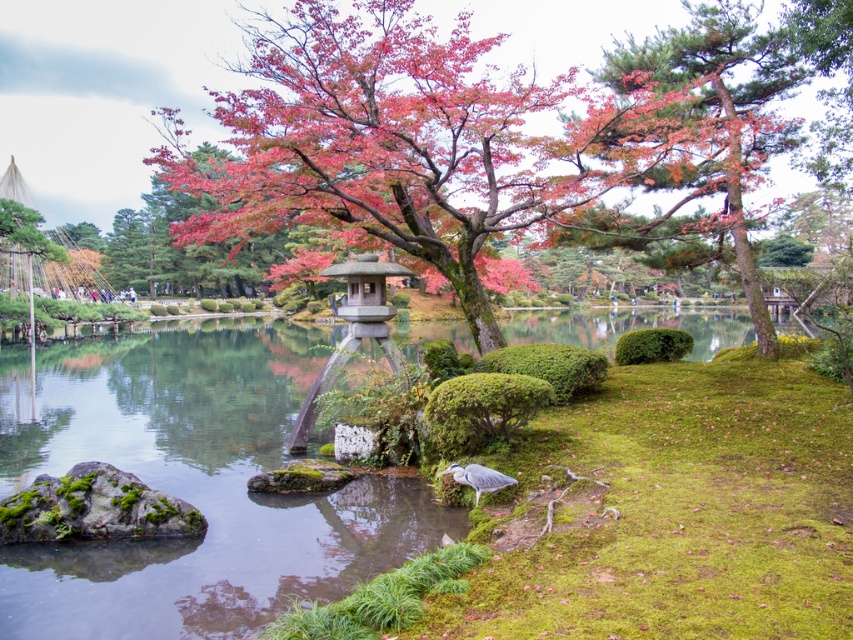
Question: Is shiny pink leaves at center wider than stone lantern at center?

Choices:
 (A) no
 (B) yes

Answer: (B)

Question: Which object is farther from the camera taking this photo?

Choices:
 (A) shiny pink leaves at center
 (B) stone lantern at center

Answer: (B)

Question: Is shiny pink leaves at center above pine tree at upper right?

Choices:
 (A) yes
 (B) no

Answer: (A)

Question: Can you confirm if shiny pink leaves at center is positioned to the left of stone lantern at center?

Choices:
 (A) yes
 (B) no

Answer: (A)

Question: Estimate the real-world distances between objects in this image. Which object is farther from the pine tree at upper right?

Choices:
 (A) stone lantern at center
 (B) shiny pink leaves at center

Answer: (A)

Question: Which is nearer to the stone lantern at center?

Choices:
 (A) pine tree at upper right
 (B) shiny pink leaves at center

Answer: (A)